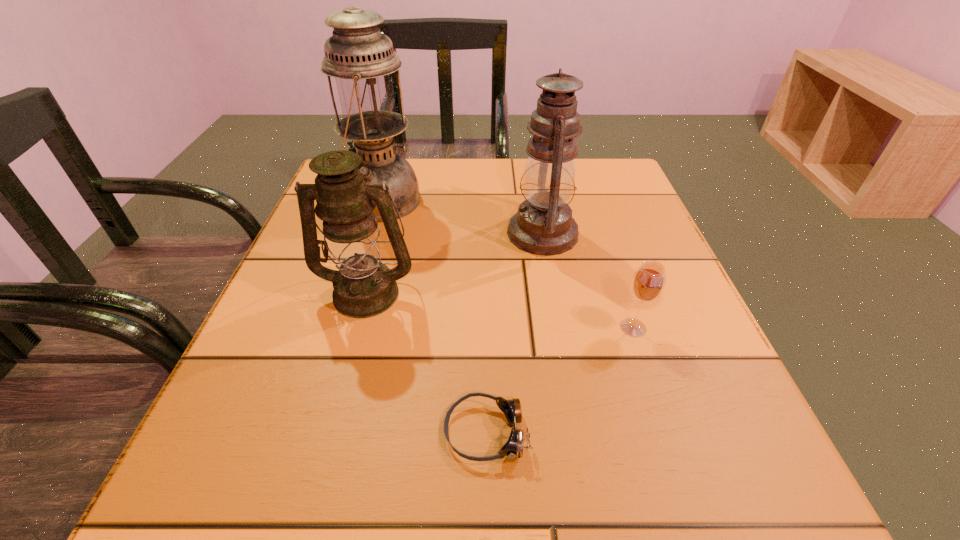
At what (x,y) coordinates should I click in order to perform the action: click on the tallest oil lamp. Please return your answer as a coordinate pair (x, y). Looking at the image, I should click on (361, 59).

The width and height of the screenshot is (960, 540). In order to click on the second tallest oil lamp in this screenshot , I will do `click(543, 225)`.

At what (x,y) coordinates should I click in order to perform the action: click on the rightmost oil lamp. Please return your answer as a coordinate pair (x, y). Looking at the image, I should click on (543, 225).

Locate an element on the screen. the third tallest object is located at coordinates (364, 287).

Identify the location of the nearest oil lamp. This screenshot has width=960, height=540. (364, 287).

In order to click on the fourth tallest object in this screenshot , I will do `click(648, 282)`.

Where is `the rightmost object`? The image size is (960, 540). the rightmost object is located at coordinates (648, 282).

Where is `the nearest object`? Image resolution: width=960 pixels, height=540 pixels. the nearest object is located at coordinates (513, 448).

In order to click on the shortest object in this screenshot , I will do `click(513, 448)`.

The height and width of the screenshot is (540, 960). Find the location of `vacant space situated on the right of the tallest object`. vacant space situated on the right of the tallest object is located at coordinates (479, 201).